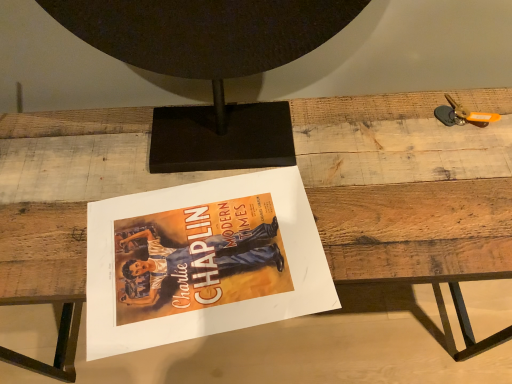
You are a GUI agent. You are given a task and a screenshot of the screen. Output one action in this format:
    pyautogui.click(x=<x>, y=<y>)
    Task: Click on the vacant space underneath matte black round table at center (from a real-world perspective)
    The image size is (512, 384).
    Given the screenshot: What is the action you would take?
    pyautogui.click(x=234, y=141)